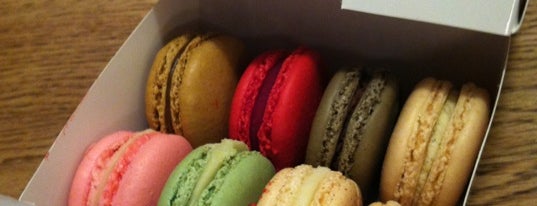
Find the location of a particular element. box is located at coordinates (124, 103).